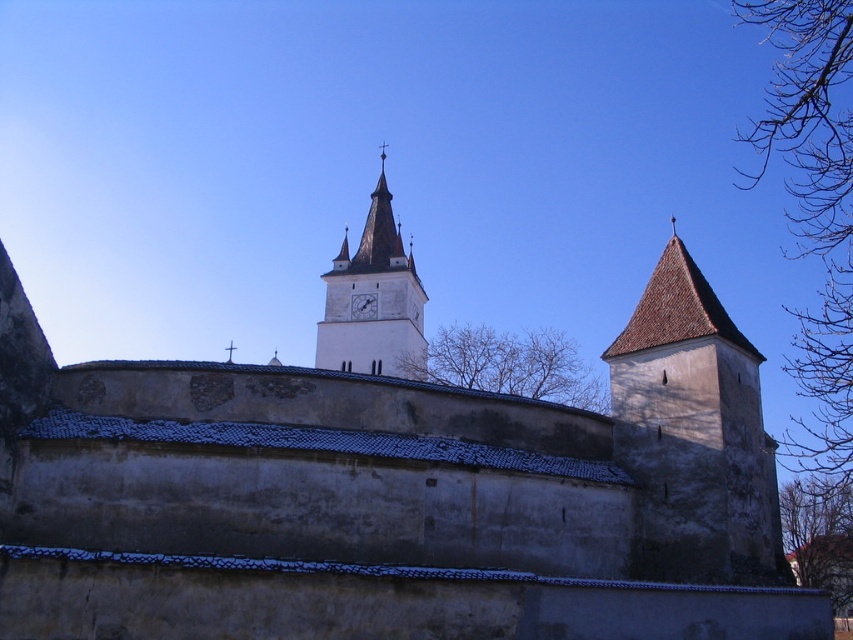
You are standing in front of the historic stone church and want to take a photo. There are two points marked in the image, point 1 at coordinates point (683, 364) and point 2 at coordinates point (357, 308). Which point is closer to your camera when you take the photo?

Point (683, 364) is closer to the camera than point (357, 308).

You are standing in front of the historic stone church and want to take a photo that includes both the brown stone tower at right and the white stone clock tower at center. Which tower should you position closer to the camera to ensure both are fully visible in the frame?

You should position the brown stone tower at right closer to the camera since it has a lesser height compared to the white stone clock tower at center, allowing both to fit within the frame by balancing their sizes.